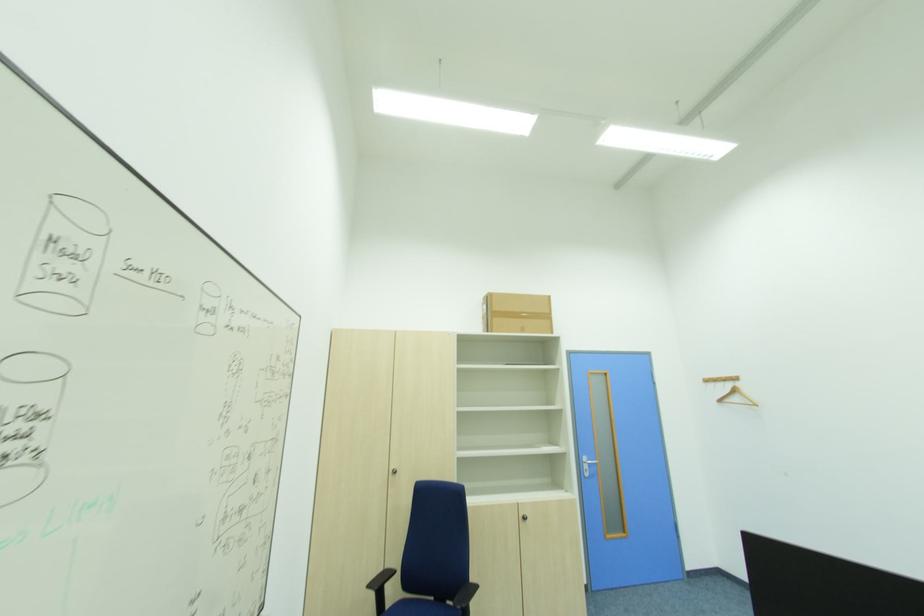
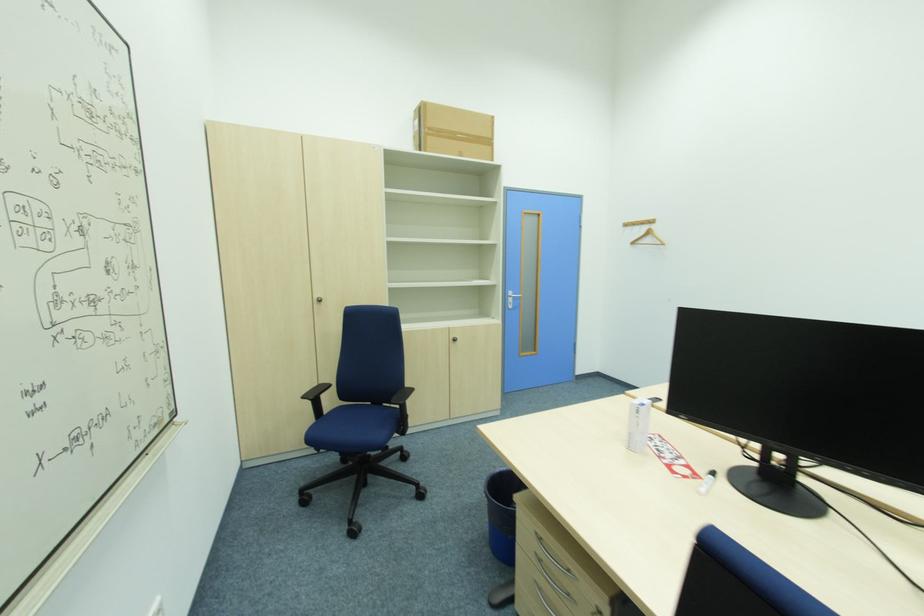
Question: Which direction would the cameraman need to move to produce the second image? Reply with the corresponding letter.

Choices:
 (A) Left
 (B) Right
 (C) Forward
 (D) Backward

Answer: (C)